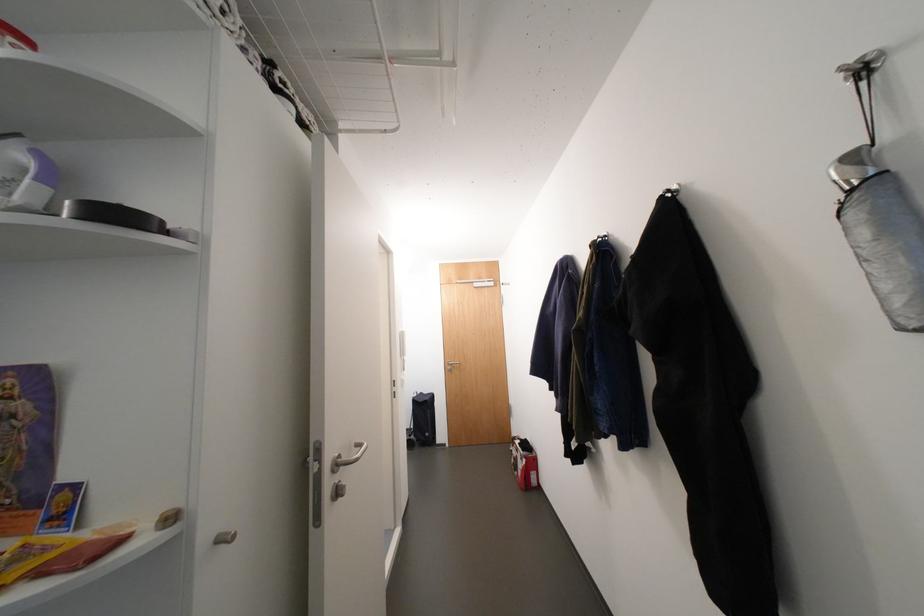
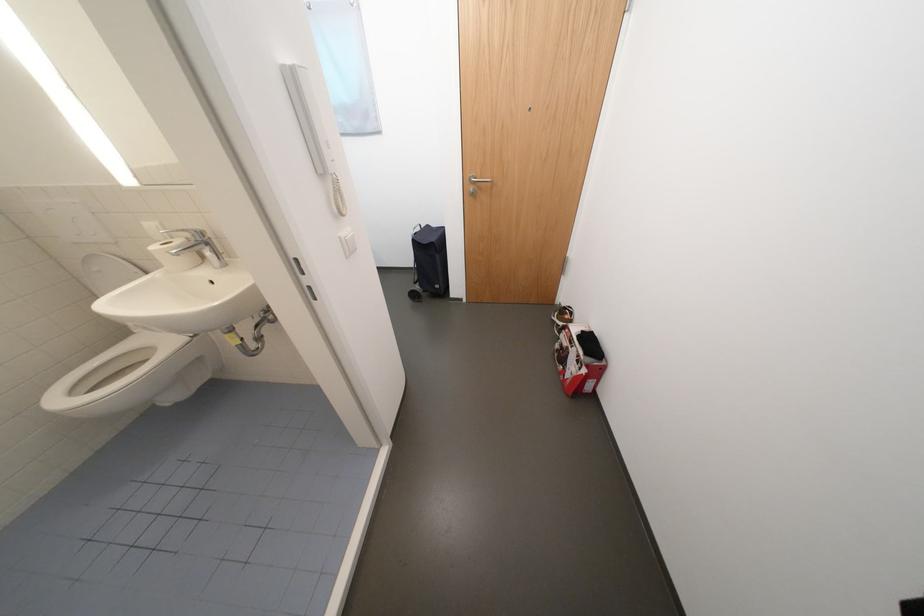
Find the pixel in the second image that matches point (435, 436) in the first image.

(445, 286)